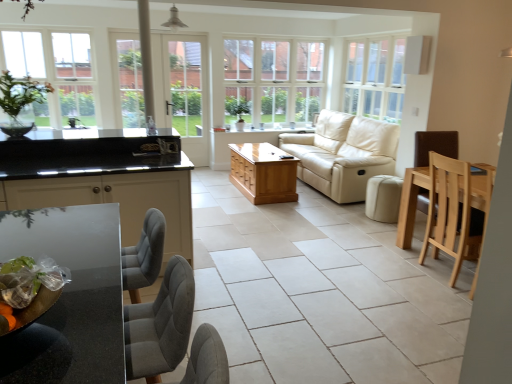
Question: Is white glass screen door at center outside of natural wood chair at right?

Choices:
 (A) no
 (B) yes

Answer: (B)

Question: Does white glass screen door at center have a smaller size compared to natural wood chair at right?

Choices:
 (A) no
 (B) yes

Answer: (B)

Question: From a real-world perspective, is white glass screen door at center physically below natural wood chair at right?

Choices:
 (A) yes
 (B) no

Answer: (B)

Question: From the image's perspective, would you say white glass screen door at center is shown under natural wood chair at right?

Choices:
 (A) yes
 (B) no

Answer: (B)

Question: Is white glass screen door at center thinner than natural wood chair at right?

Choices:
 (A) no
 (B) yes

Answer: (B)

Question: Is white glass screen door at center bigger than natural wood chair at right?

Choices:
 (A) no
 (B) yes

Answer: (A)

Question: Would you say green glass vase at upper left is outside white wood window at upper right, which appears as the third window when viewed from the left?

Choices:
 (A) yes
 (B) no

Answer: (A)

Question: Does green glass vase at upper left have a smaller size compared to white wood window at upper right, the 1th window in the right-to-left sequence?

Choices:
 (A) no
 (B) yes

Answer: (B)

Question: Can you confirm if green glass vase at upper left is wider than white wood window at upper right, the 1th window in the right-to-left sequence?

Choices:
 (A) no
 (B) yes

Answer: (B)

Question: Would you say green glass vase at upper left contains white wood window at upper right, which appears as the third window when viewed from the left?

Choices:
 (A) yes
 (B) no

Answer: (B)

Question: Can you confirm if green glass vase at upper left is bigger than white wood window at upper right, the 1th window in the right-to-left sequence?

Choices:
 (A) yes
 (B) no

Answer: (B)

Question: Considering the relative positions of green glass vase at upper left and white wood window at upper right, which appears as the third window when viewed from the left, in the image provided, is green glass vase at upper left to the left of white wood window at upper right, which appears as the third window when viewed from the left, from the viewer's perspective?

Choices:
 (A) no
 (B) yes

Answer: (B)

Question: Can you confirm if clear glass window at upper left, the first window viewed from the left, is smaller than green glass vase at upper left?

Choices:
 (A) yes
 (B) no

Answer: (B)